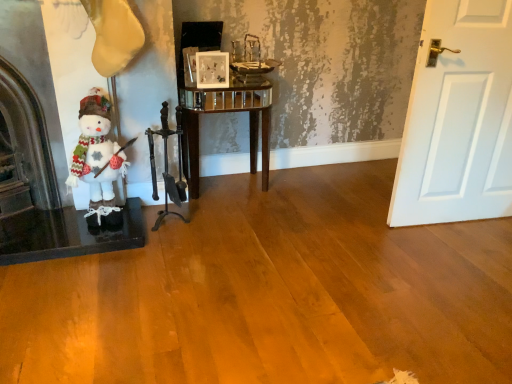
At what (x,y) coordinates should I click in order to perform the action: click on free point in front of glossy wood side table at center. Please return your answer as a coordinate pair (x, y). This screenshot has height=384, width=512. Looking at the image, I should click on (236, 218).